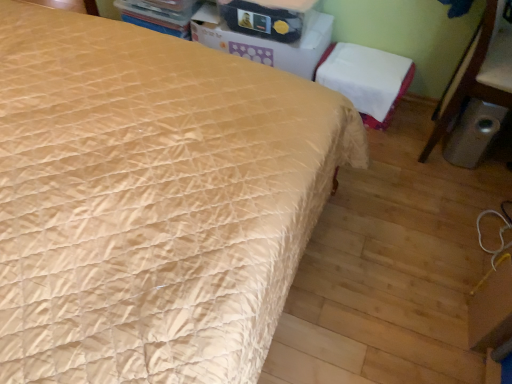
Question: Is matte cardboard box at upper center inside the boundaries of white cardboard box at upper center, or outside?

Choices:
 (A) inside
 (B) outside

Answer: (B)

Question: From a real-world perspective, relative to white cardboard box at upper center, is matte cardboard box at upper center vertically above or below?

Choices:
 (A) above
 (B) below

Answer: (A)

Question: Based on their relative distances, which object is farther from the metallic trash can at lower right?

Choices:
 (A) white cardboard box at upper center
 (B) matte cardboard box at upper center
 (C) white fabric chair at upper right

Answer: (B)

Question: Which object is positioned closest to the white fabric chair at upper right?

Choices:
 (A) matte cardboard box at upper center
 (B) metallic trash can at lower right
 (C) white cardboard box at upper center

Answer: (C)